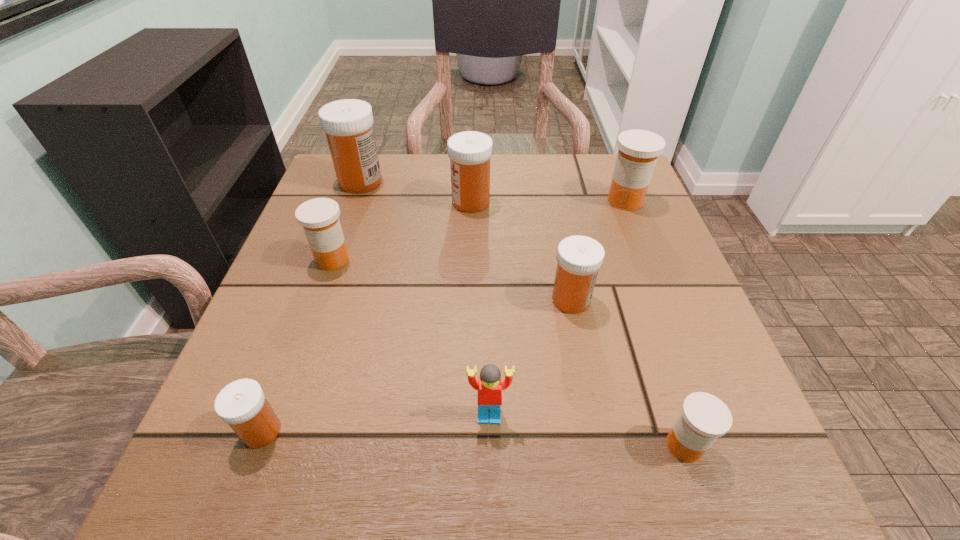
At what (x,y) coordinates should I click in order to perform the action: click on free spot between the tallest medicine and the farthest orange medicine. Please return your answer as a coordinate pair (x, y). The height and width of the screenshot is (540, 960). Looking at the image, I should click on (492, 191).

Identify the location of vacant space that is in between the second smallest white medicine and the nearest white medicine. (417, 366).

Choose which object is the sixth nearest neighbor to the third smallest white medicine. Please provide its 2D coordinates. Your answer should be formatted as a tuple, i.e. [(x, y)], where the tuple contains the x and y coordinates of a point satisfying the conditions above.

[(242, 404)]

Select which object is the closest to the second nearest orange medicine. Please provide its 2D coordinates. Your answer should be formatted as a tuple, i.e. [(x, y)], where the tuple contains the x and y coordinates of a point satisfying the conditions above.

[(348, 124)]

Find the location of a particular element. medicine identified as the third closest to the farthest orange medicine is located at coordinates (704, 417).

Identify which medicine is located as the second nearest to the nearest orange medicine. Please provide its 2D coordinates. Your answer should be formatted as a tuple, i.e. [(x, y)], where the tuple contains the x and y coordinates of a point satisfying the conditions above.

[(638, 151)]

Select which white medicine is the third closest to the second smallest orange medicine. Please provide its 2D coordinates. Your answer should be formatted as a tuple, i.e. [(x, y)], where the tuple contains the x and y coordinates of a point satisfying the conditions above.

[(242, 404)]

Select which white medicine is the closest to the Lego. Please provide its 2D coordinates. Your answer should be formatted as a tuple, i.e. [(x, y)], where the tuple contains the x and y coordinates of a point satisfying the conditions above.

[(579, 258)]

This screenshot has height=540, width=960. What are the coordinates of `orange medicine that is the closest to the Lego` in the screenshot? It's located at (704, 417).

This screenshot has height=540, width=960. I want to click on the second closest orange medicine to the farthest orange medicine, so click(319, 217).